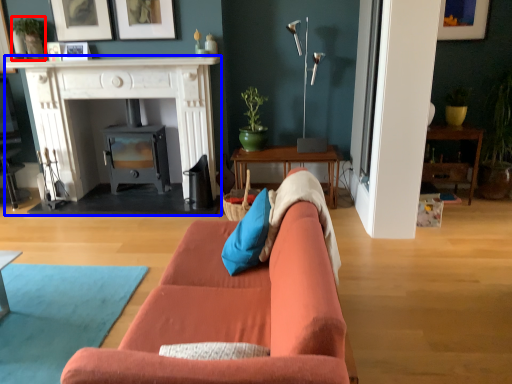
Question: Which object appears closest to the camera in this image, houseplant (highlighted by a red box) or fireplace (highlighted by a blue box)?

Choices:
 (A) houseplant
 (B) fireplace

Answer: (B)